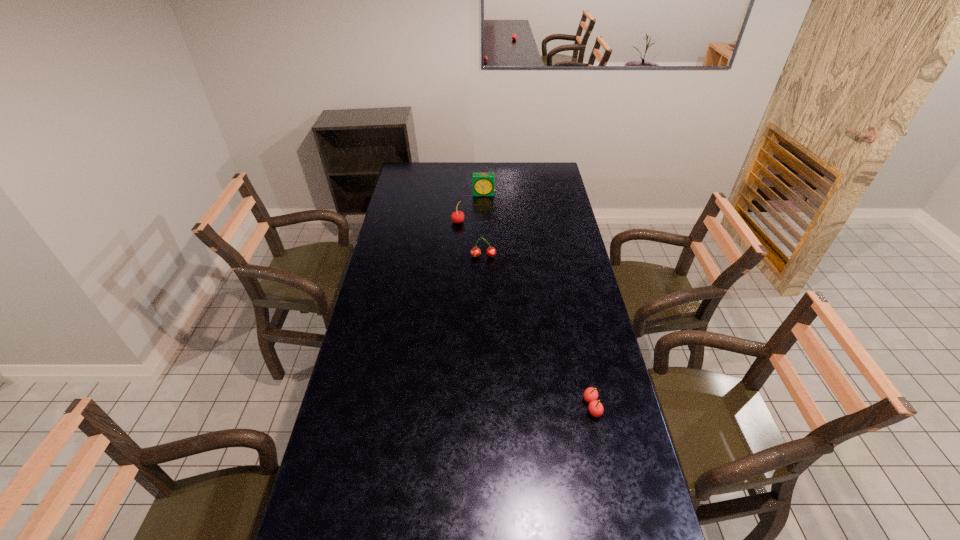
Identify the location of vacant region located 0.300m on the front of the rightmost object. (617, 526).

Locate an element on the screen. This screenshot has width=960, height=540. object that is at the right edge is located at coordinates (596, 409).

The width and height of the screenshot is (960, 540). In the image, there is a desktop. Find the location of `blank space at the far edge`. blank space at the far edge is located at coordinates (446, 174).

The height and width of the screenshot is (540, 960). I want to click on free point at the left edge, so click(399, 348).

Find the location of a particular element. blank area at the right edge is located at coordinates (579, 287).

The image size is (960, 540). In the image, there is a desktop. In order to click on free region at the far right corner in this screenshot , I will do `click(538, 163)`.

Identify the location of empty location between the farthest object and the shortest object. This screenshot has height=540, width=960. (538, 300).

The width and height of the screenshot is (960, 540). In order to click on unoccupied position between the rightmost object and the second cherry from left to right in this screenshot , I will do `click(538, 332)`.

Where is `free spot between the farthest object and the second cherry from right to left`? The height and width of the screenshot is (540, 960). free spot between the farthest object and the second cherry from right to left is located at coordinates (484, 225).

The height and width of the screenshot is (540, 960). Identify the location of vacant area between the alarm clock and the rightmost cherry. (538, 300).